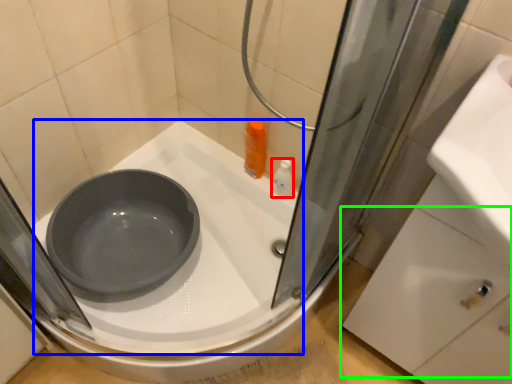
Question: Based on their relative distances, which object is nearer to toiletry (highlighted by a red box)? Choose from bath (highlighted by a blue box) and drawer (highlighted by a green box).

Choices:
 (A) bath
 (B) drawer

Answer: (A)